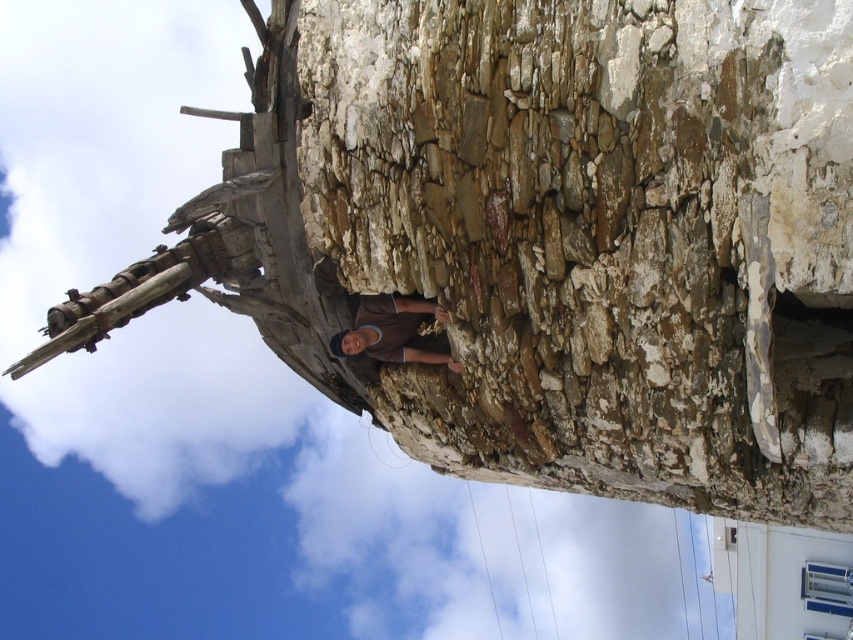
You are standing in front of the rustic stone structure. Where exactly is the rusty stone wall at center located in terms of coordinates?

The rusty stone wall at center is located at coordinates point [601,236].

You are standing in front of the rustic stone structure and notice the rusty stone wall at center and the brown matte shirt at center. Which object is taller?

The rusty stone wall at center is taller than the brown matte shirt at center.

You are standing in front of the rustic stone structure and notice the rusty stone wall at center and the brown matte shirt at center. From your perspective, which object is closer to you?

The rusty stone wall at center is positioned over the brown matte shirt at center, meaning it is closer to you.